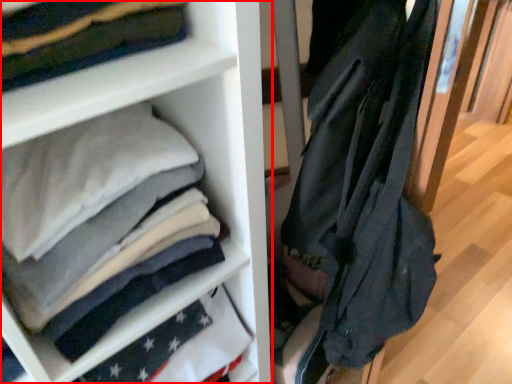
Question: In this image, where is shelf (annotated by the red box) located relative to garment?

Choices:
 (A) left
 (B) right

Answer: (A)